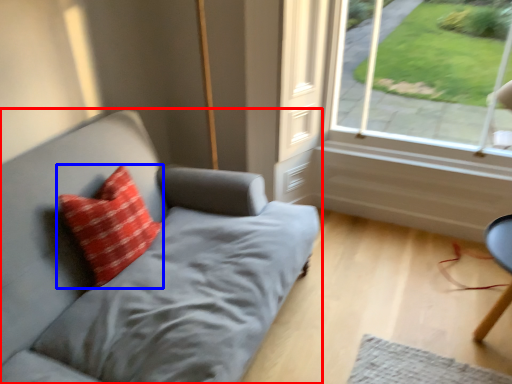
Question: Which object appears closest to the camera in this image, studio couch (highlighted by a red box) or pillow (highlighted by a blue box)?

Choices:
 (A) studio couch
 (B) pillow

Answer: (A)